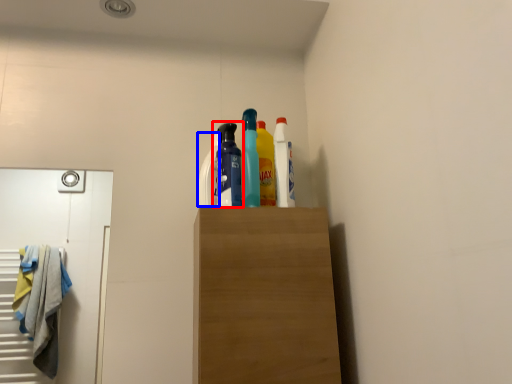
Question: Which of the following is the closest to the observer, bottle (highlighted by a red box) or cleaning product (highlighted by a blue box)?

Choices:
 (A) bottle
 (B) cleaning product

Answer: (A)